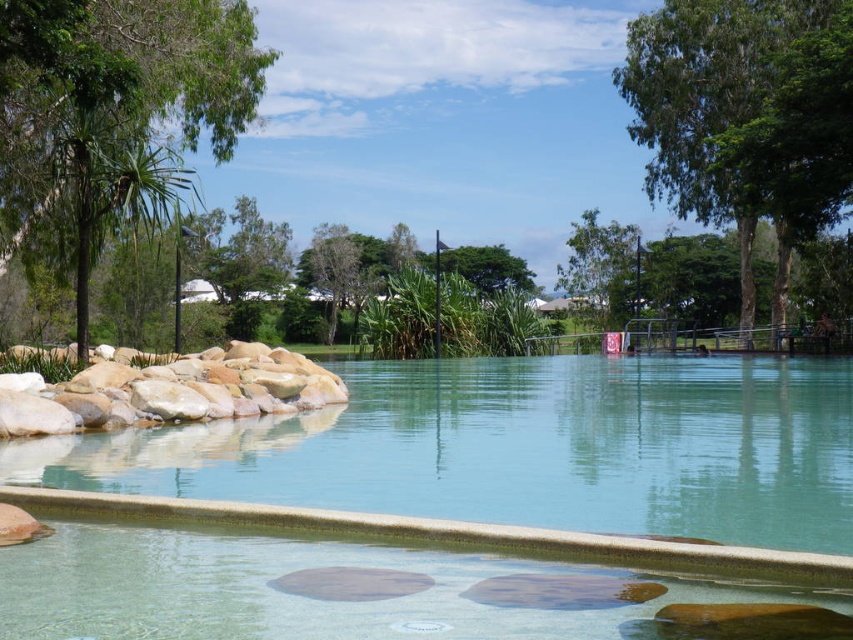
Question: Can you confirm if smooth beige rock at left is positioned below green leafy tree at upper center?

Choices:
 (A) yes
 (B) no

Answer: (A)

Question: In this image, where is green leafy tree at right located relative to green leafy tree at center?

Choices:
 (A) left
 (B) right

Answer: (B)

Question: Which of these objects is positioned closest to the green leafy tree at upper center?

Choices:
 (A) green leafy tree at left
 (B) green leafy tree at right

Answer: (B)

Question: Is green leafy tree at left above green leafy tree at center?

Choices:
 (A) yes
 (B) no

Answer: (B)

Question: Which object is closer to the camera taking this photo?

Choices:
 (A) green leafy tree at left
 (B) green leafy tree at center

Answer: (A)

Question: Based on their relative distances, which object is nearer to the smooth beige rock at left?

Choices:
 (A) green leafy tree at right
 (B) green leafy tree at left
 (C) green leafy tree at center

Answer: (B)